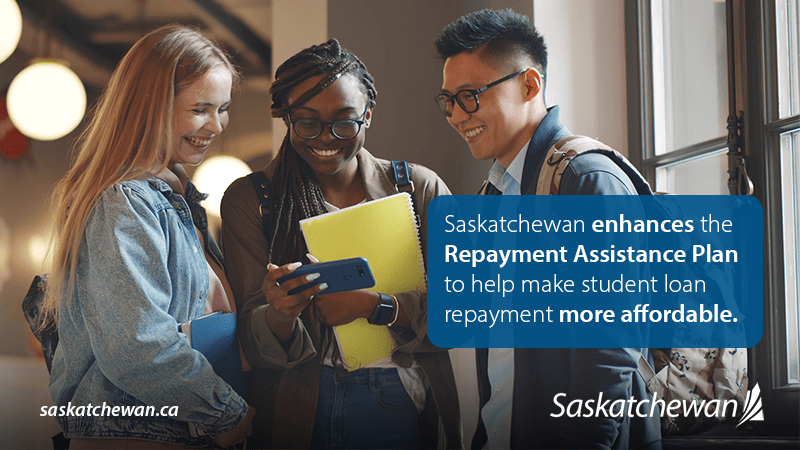
Where is `phone`? The image size is (800, 450). phone is located at coordinates (318, 270).